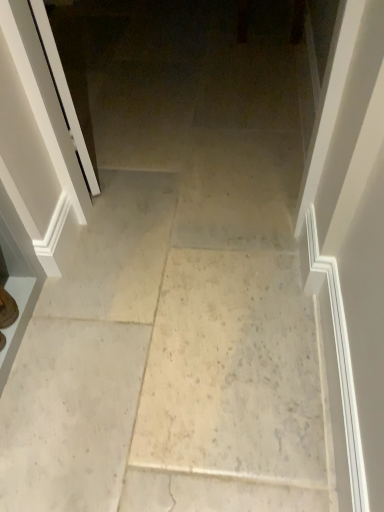
Locate an element on the screen. This screenshot has width=384, height=512. vacant space to the right of white glossy screen door at left is located at coordinates (151, 141).